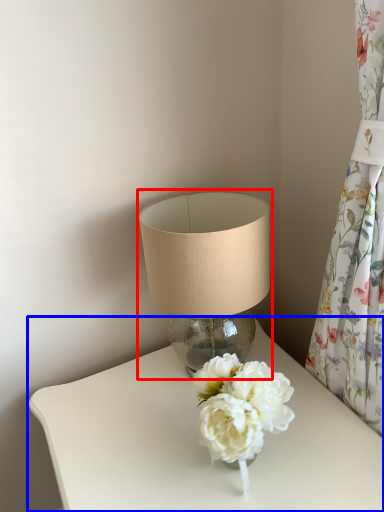
Question: Which object appears farthest to the camera in this image, lamp (highlighted by a red box) or table (highlighted by a blue box)?

Choices:
 (A) lamp
 (B) table

Answer: (A)